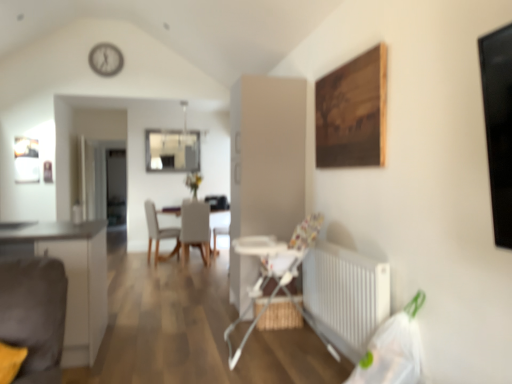
Question: Is matte gray chair at center, which ranks as the first chair in right-to-left order, inside the boundaries of white metallic radiator at lower right, or outside?

Choices:
 (A) outside
 (B) inside

Answer: (A)

Question: Considering the positions of matte gray chair at center, which ranks as the first chair in right-to-left order, and white metallic radiator at lower right in the image, is matte gray chair at center, which ranks as the first chair in right-to-left order, taller or shorter than white metallic radiator at lower right?

Choices:
 (A) tall
 (B) short

Answer: (A)

Question: Which is farther from the white plastic high chair at center?

Choices:
 (A) matte gray chair at center, which ranks as the first chair in right-to-left order
 (B) white metallic radiator at lower right
 (C) transparent glass window at center
 (D) white fabric chair at center, arranged as the 1th chair when viewed from the left
 (E) matte white cabinet at left

Answer: (C)

Question: Which is farther from the white plastic high chair at center?

Choices:
 (A) transparent glass window at center
 (B) white metallic radiator at lower right
 (C) wooden painting at upper right
 (D) white fabric chair at center, the 2th chair in the right-to-left sequence
 (E) matte white cabinet at left

Answer: (A)